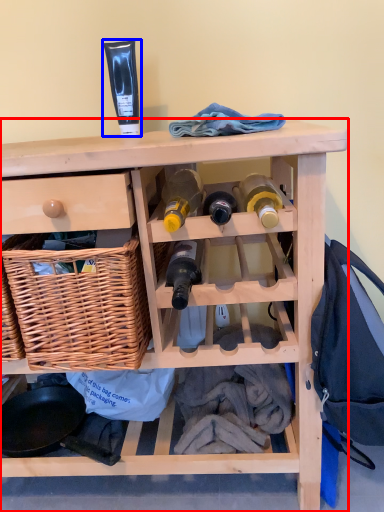
Question: Which object is further to the camera taking this photo, furniture (highlighted by a red box) or toiletry (highlighted by a blue box)?

Choices:
 (A) furniture
 (B) toiletry

Answer: (B)